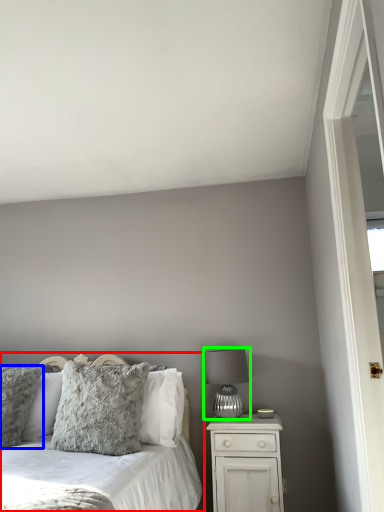
Question: Estimate the real-world distances between objects in this image. Which object is farther from bed (highlighted by a red box), pillow (highlighted by a blue box) or table lamp (highlighted by a green box)?

Choices:
 (A) pillow
 (B) table lamp

Answer: (B)